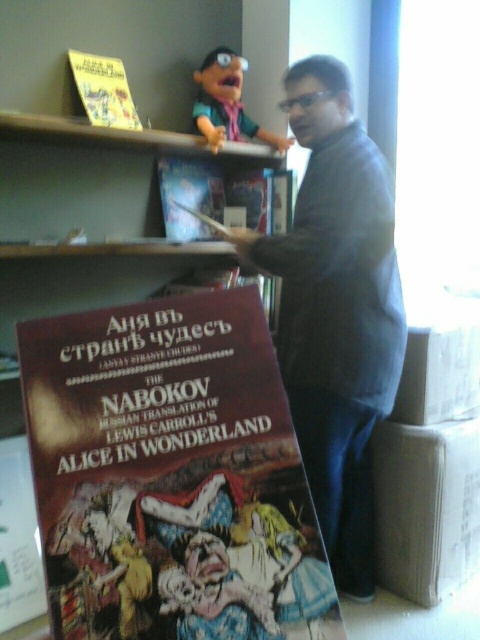
You are an interior designer assessing the layout of a library. You notice two points marked in the image. The first point is at coordinate point(317, 636) and the second is at point(132, 124). From the perspective of someone standing at the entrance of the library, which point is closer to the viewer?

Point(317, 636) is in front of point(132, 124), so it is closer to the viewer standing at the entrance of the library.

You are organizing a display in a bookstore and need to place the pink fabric doll at upper center. According to the image, where should you position it relative to the shelf?

The pink fabric doll at upper center should be positioned at point 0.163 on the x axis and 0.473 on the y axis relative to the shelf.